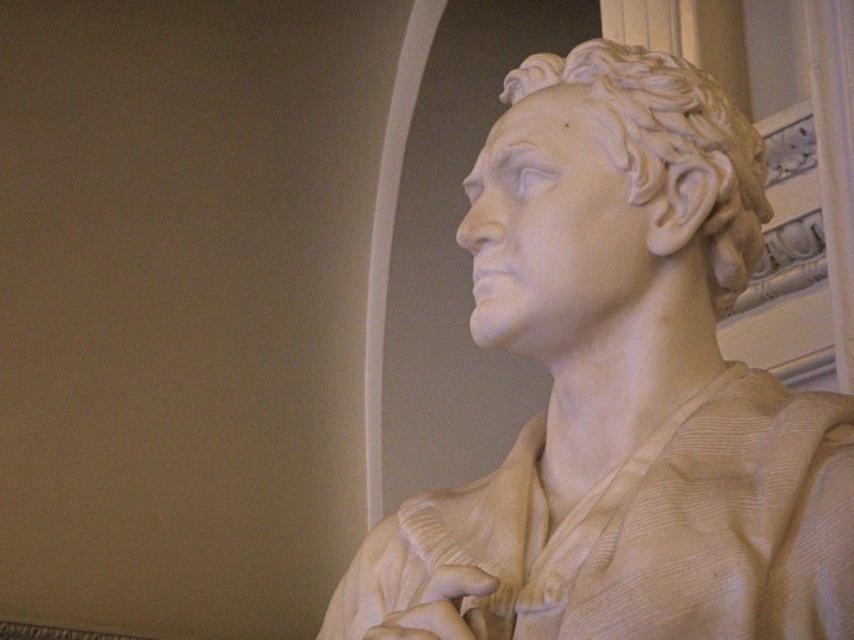
Between white marble bust at right and white marble head at center, which one is positioned higher?

white marble head at center

Does white marble bust at right have a smaller size compared to white marble head at center?

No, white marble bust at right is not smaller than white marble head at center.

Describe the element at coordinates (623, 390) in the screenshot. The image size is (854, 640). I see `white marble bust at right` at that location.

Identify the location of white marble bust at right. The height and width of the screenshot is (640, 854). tap(623, 390).